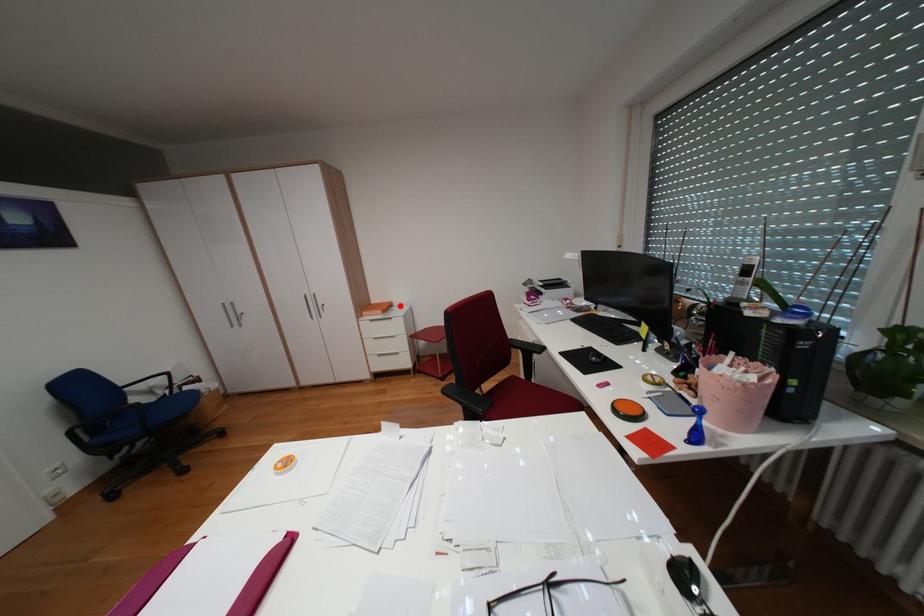
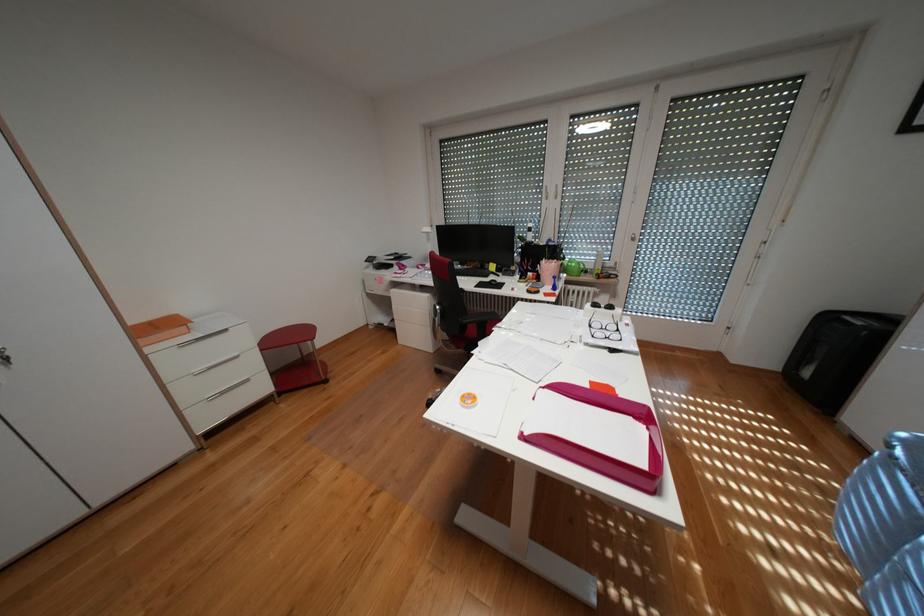
Locate, in the second image, the point that corresponds to the highlighted location in the first image.

(184, 323)